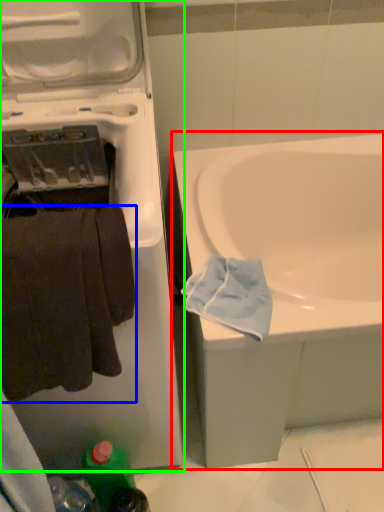
Question: Considering the real-world distances, which object is closest to bathtub (highlighted by a red box)? towel (highlighted by a blue box) or washing machine (highlighted by a green box).

Choices:
 (A) towel
 (B) washing machine

Answer: (B)